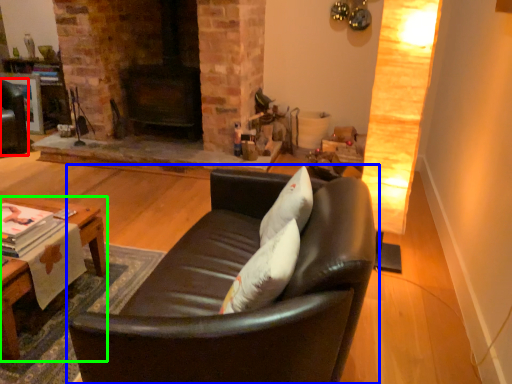
Question: Considering the real-world distances, which object is closest to swivel chair (highlighted by a red box)? studio couch (highlighted by a blue box) or table (highlighted by a green box).

Choices:
 (A) studio couch
 (B) table

Answer: (B)